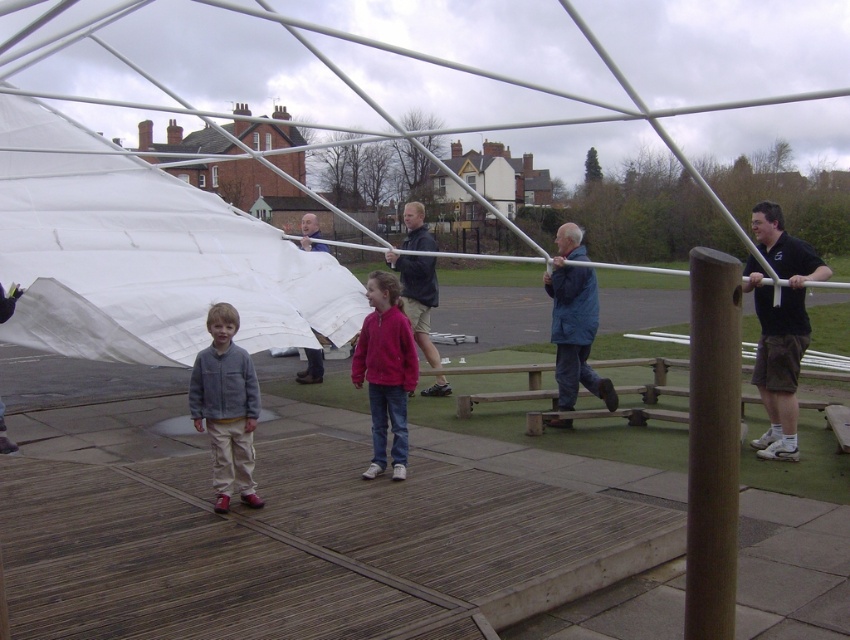
You are standing at the wooden platform where the two children are located. You need to hand a tool to the person wearing the blue fabric jacket at center. Which direction should you walk to reach them?

The blue fabric jacket at center is located at point (574,321), so you should walk towards the center of the image to reach them.

You are a photographer standing at the edge of the scene. You need to capture a photo that includes both the dark blue jacket at center and the matte white tent at center. Which object should you focus on first to ensure both are in frame?

You should focus on the matte white tent at center first because it is taller than the dark blue jacket at center, so adjusting the camera angle to accommodate its height will help include both in the frame.

You are a delivery person who needs to place a package between the blue fabric jacket at center and the matte white tent at center. The package requires a space of 4 meters. Is there enough space between them?

The blue fabric jacket at center and the matte white tent at center are 3.94 meters apart from each other. Since the required space is 4 meters, there is not enough space to place the package between them.